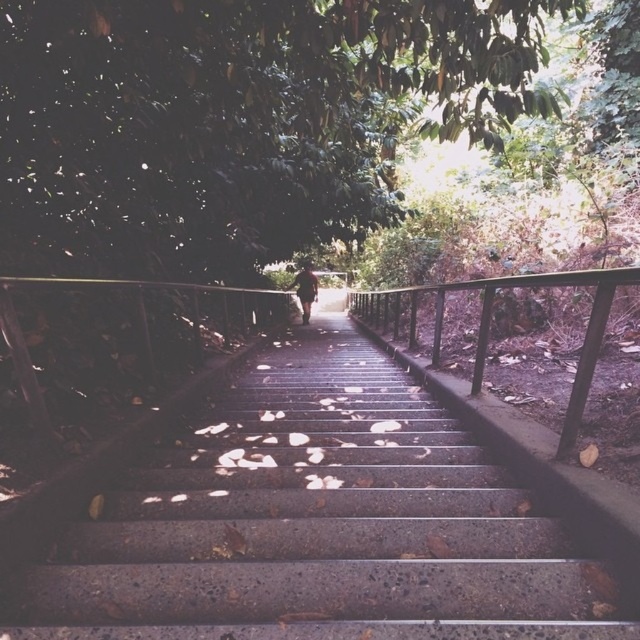
Between point (477, 280) and point (301, 273), which one is positioned in front?

Positioned in front is point (477, 280).

Is point (593, 276) behind point (300, 291)?

No, (593, 276) is closer to viewer.

Locate an element on the screen. The image size is (640, 640). metallic black balustrade at center is located at coordinates (490, 323).

Does concrete stairs at center appear on the right side of dark brown leather jacket at center?

Yes, concrete stairs at center is to the right of dark brown leather jacket at center.

Can you confirm if concrete stairs at center is bigger than dark brown leather jacket at center?

Yes, concrete stairs at center is bigger than dark brown leather jacket at center.

Which is behind, point (513, 625) or point (298, 288)?

The point (298, 288) is more distant.

This screenshot has width=640, height=640. I want to click on concrete stairs at center, so click(317, 524).

This screenshot has height=640, width=640. Describe the element at coordinates (317, 524) in the screenshot. I see `concrete stairs at center` at that location.

Locate an element on the screen. concrete stairs at center is located at coordinates (317, 524).